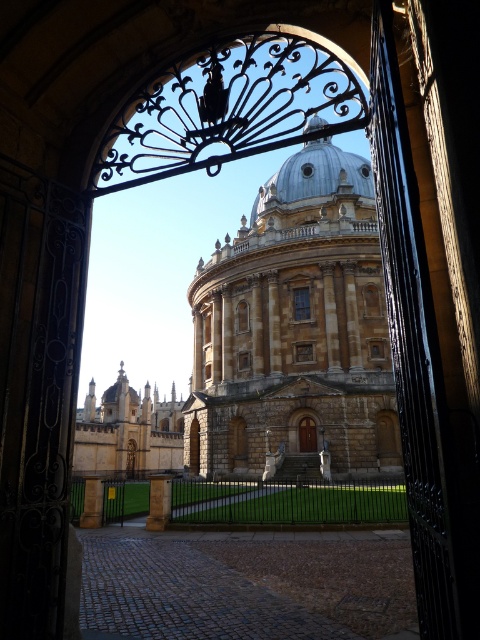
You are standing outside the ornate wrought iron gate looking at the grand building. You notice the stone dome at center and the smooth stone pillar at center. Which of these two objects is positioned higher up in the scene?

The stone dome at center is positioned higher up in the scene because it is above the smooth stone pillar at center.

You are standing outside the ornate wrought iron gate looking at the grand building. You notice a metallic silver dome at center and a stone pillar at center. Which object is positioned to the right side from your perspective?

The metallic silver dome at center is positioned to the right of the stone pillar at center from your perspective.

You are standing outside the ornate wrought iron gate looking at the grand building. There is a point marked at coordinates (314,173). What does this point indicate?

The point at coordinates (314,173) marks the metallic silver dome at center.